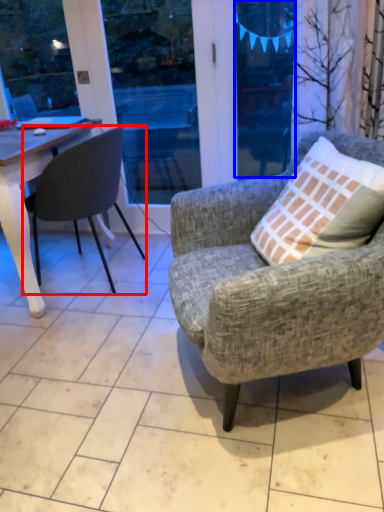
Question: Among these objects, which one is nearest to the camera, chair (highlighted by a red box) or window screen (highlighted by a blue box)?

Choices:
 (A) chair
 (B) window screen

Answer: (A)